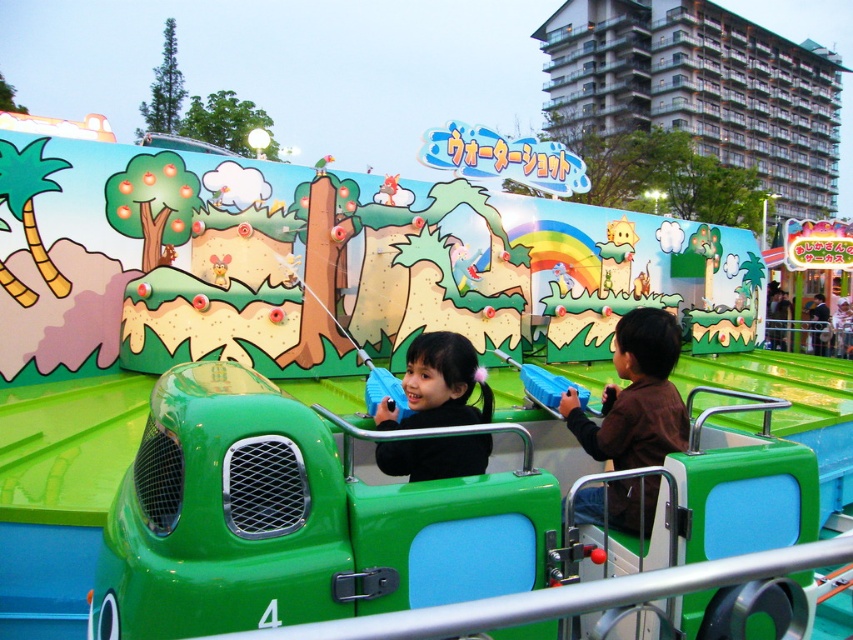
Question: Which object is closer to the camera taking this photo?

Choices:
 (A) black matte jacket at center
 (B) brown matte jacket at center

Answer: (A)

Question: Is brown matte jacket at center above black matte jacket at center?

Choices:
 (A) yes
 (B) no

Answer: (B)

Question: Can you confirm if brown matte jacket at center is positioned above black matte jacket at center?

Choices:
 (A) no
 (B) yes

Answer: (A)

Question: Can you confirm if brown matte jacket at center is thinner than black matte jacket at center?

Choices:
 (A) no
 (B) yes

Answer: (A)